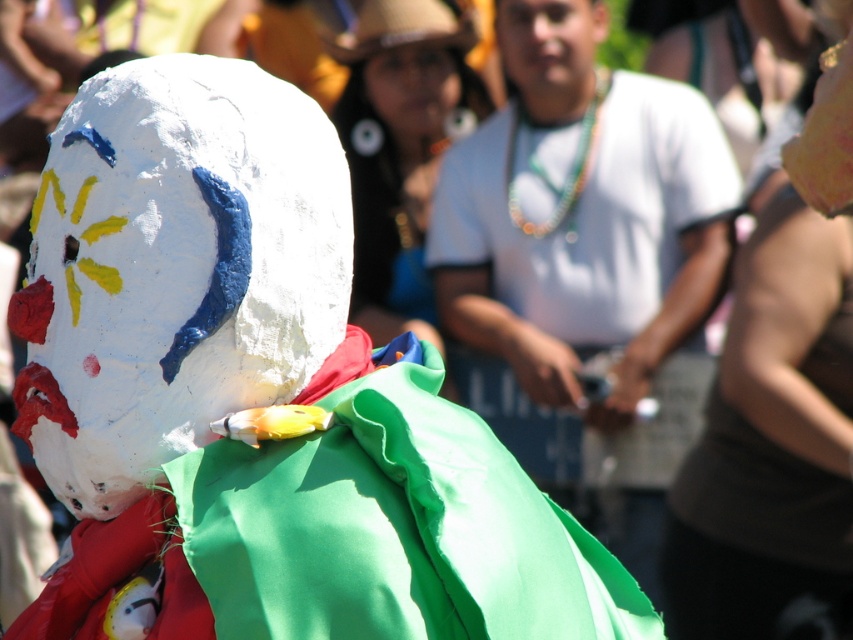
You are at a festival and see a person wearing a handmade mask and costume. The mask has a yellow sun design with red petals and a blue leaf. The costume has green fabric on the shoulders. You want to take a photo of the white papier mache mask at center. Where should you aim your camera to capture the mask? Please provide coordinates as a point in the format of point, for example point (120, 301).

The white papier mache mask at center is located at point (120, 301), so you should aim your camera at point (120, 301) to capture the mask.

You are a photographer at a cultural festival. You want to take a portrait focusing on the smooth skin face at upper center and the matte white mask at upper center. Since the mask has intricate details, you need to ensure both the face and mask are fully visible. Given their sizes, is there enough space in the frame to capture both without cropping either?

The smooth skin face at upper center is taller than the matte white mask at upper center. Since the face is taller, there is sufficient vertical space in the frame to include both the smooth skin face at upper center and the matte white mask at upper center without cropping either.